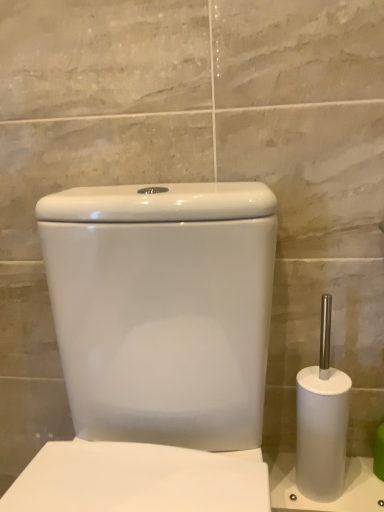
This screenshot has height=512, width=384. Describe the element at coordinates (163, 309) in the screenshot. I see `white glossy toilet at center` at that location.

Locate an element on the screen. The height and width of the screenshot is (512, 384). white glossy toilet at center is located at coordinates (163, 309).

The image size is (384, 512). What are the coordinates of `white glossy toilet at center` in the screenshot? It's located at click(x=163, y=309).